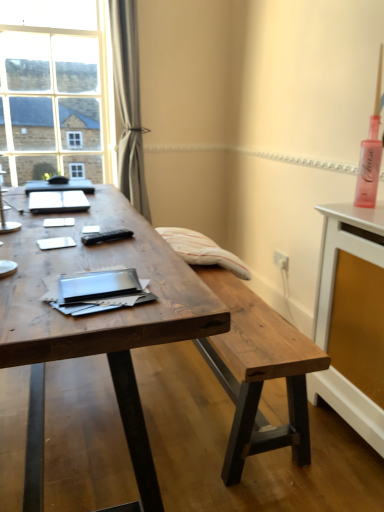
Question: Is matte black notebook at center next to rustic wood bench at center and touching it?

Choices:
 (A) no
 (B) yes

Answer: (A)

Question: From the image's perspective, is matte black notebook at center over rustic wood bench at center?

Choices:
 (A) yes
 (B) no

Answer: (A)

Question: Can you confirm if matte black notebook at center is positioned to the right of rustic wood bench at center?

Choices:
 (A) yes
 (B) no

Answer: (B)

Question: Is the depth of matte black notebook at center greater than that of rustic wood bench at center?

Choices:
 (A) yes
 (B) no

Answer: (A)

Question: Is rustic wood bench at center located within matte black notebook at center?

Choices:
 (A) yes
 (B) no

Answer: (B)

Question: Is matte black notebook at center positioned far away from rustic wood bench at center?

Choices:
 (A) yes
 (B) no

Answer: (B)

Question: Is wooden desk at center outside white glossy sideboard at right?

Choices:
 (A) yes
 (B) no

Answer: (A)

Question: Does wooden desk at center have a greater width compared to white glossy sideboard at right?

Choices:
 (A) no
 (B) yes

Answer: (B)

Question: Is wooden desk at center to the left of white glossy sideboard at right from the viewer's perspective?

Choices:
 (A) no
 (B) yes

Answer: (B)

Question: Is wooden desk at center facing towards white glossy sideboard at right?

Choices:
 (A) no
 (B) yes

Answer: (A)

Question: Can you confirm if wooden desk at center is shorter than white glossy sideboard at right?

Choices:
 (A) no
 (B) yes

Answer: (B)

Question: Is wooden desk at center taller than white glossy sideboard at right?

Choices:
 (A) no
 (B) yes

Answer: (A)

Question: Can you confirm if satin gray curtain at upper left is wider than wooden desk at center?

Choices:
 (A) no
 (B) yes

Answer: (A)